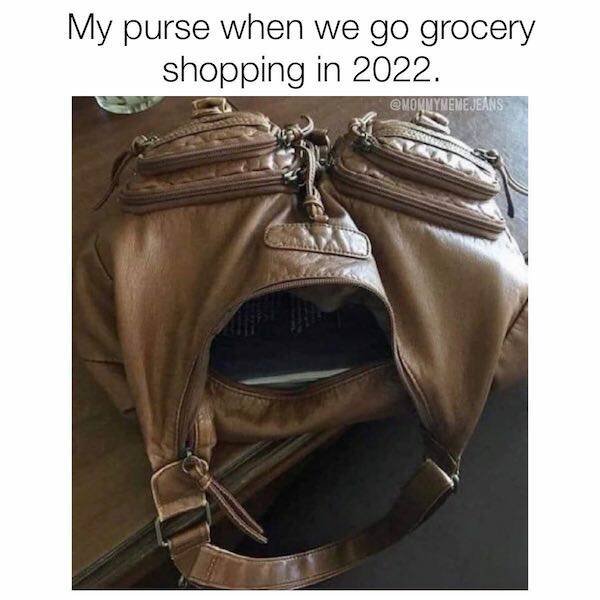
The image size is (600, 600). Find the location of `floor`. floor is located at coordinates (502, 465).